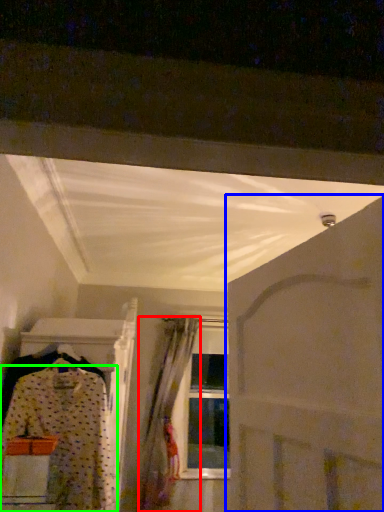
Question: Which object is positioned closest to curtain (highlighted by a red box)? Select from door (highlighted by a blue box) and fancy dress (highlighted by a green box).

Choices:
 (A) door
 (B) fancy dress

Answer: (B)